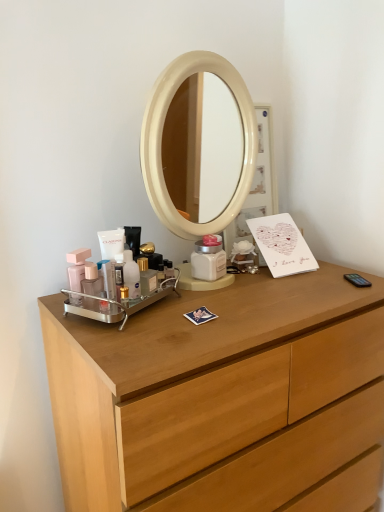
The height and width of the screenshot is (512, 384). I want to click on free spot in front of matte pink bottle at left, the 3th toiletry in the right-to-left sequence, so click(115, 342).